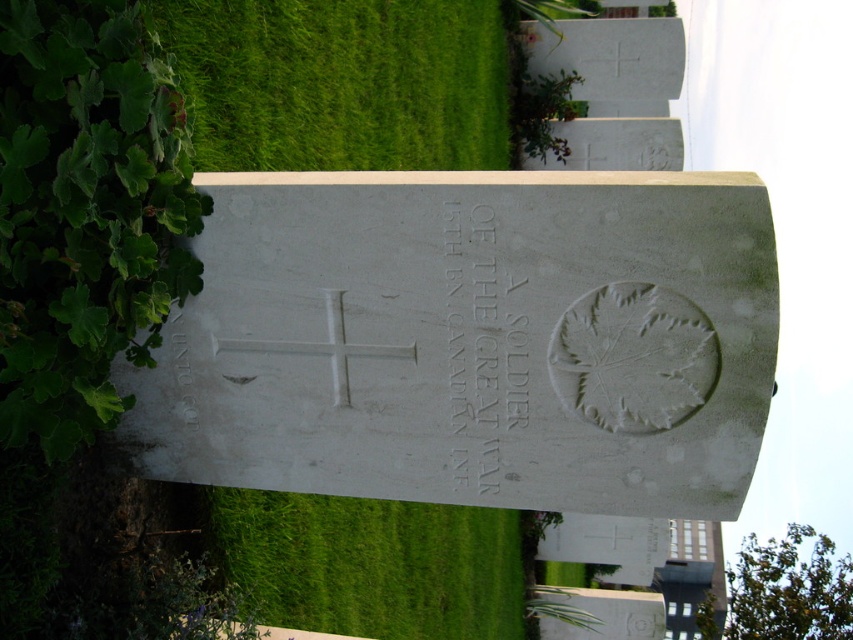
Is white stone inscription at center in front of green leafy hedge at upper center?

Yes, it is.

Between white stone inscription at center and green leafy hedge at upper center, which one has more height?

white stone inscription at center

Locate an element on the screen. white stone inscription at center is located at coordinates (482, 348).

Between point (202, 22) and point (804, 579), which one is positioned behind?

The point (804, 579) is behind.

Image resolution: width=853 pixels, height=640 pixels. What are the coordinates of `green grass at upper left` in the screenshot? It's located at (341, 83).

Is green grass at upper left above white stone inscription at center?

Yes, green grass at upper left is above white stone inscription at center.

Is point (271, 29) positioned after point (494, 266)?

Yes, it is behind point (494, 266).

The height and width of the screenshot is (640, 853). In order to click on green grass at upper left in this screenshot , I will do `click(341, 83)`.